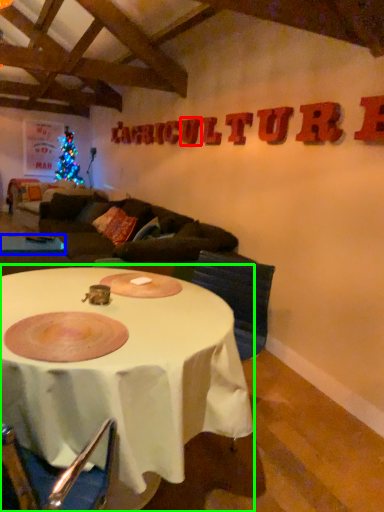
Question: Based on their relative distances, which object is farther from letter (highlighted by a red box)? Choose from table (highlighted by a blue box) and table (highlighted by a green box).

Choices:
 (A) table
 (B) table

Answer: (B)